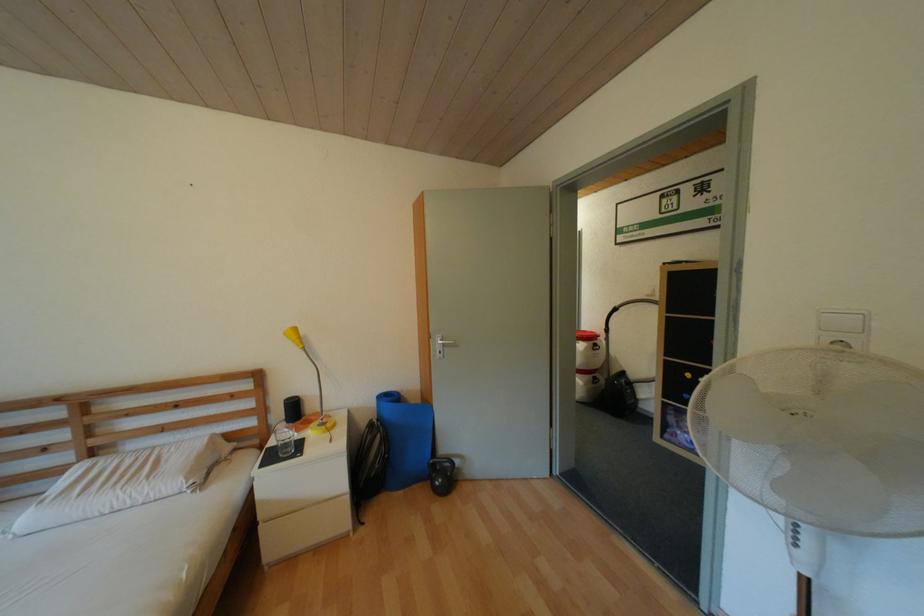
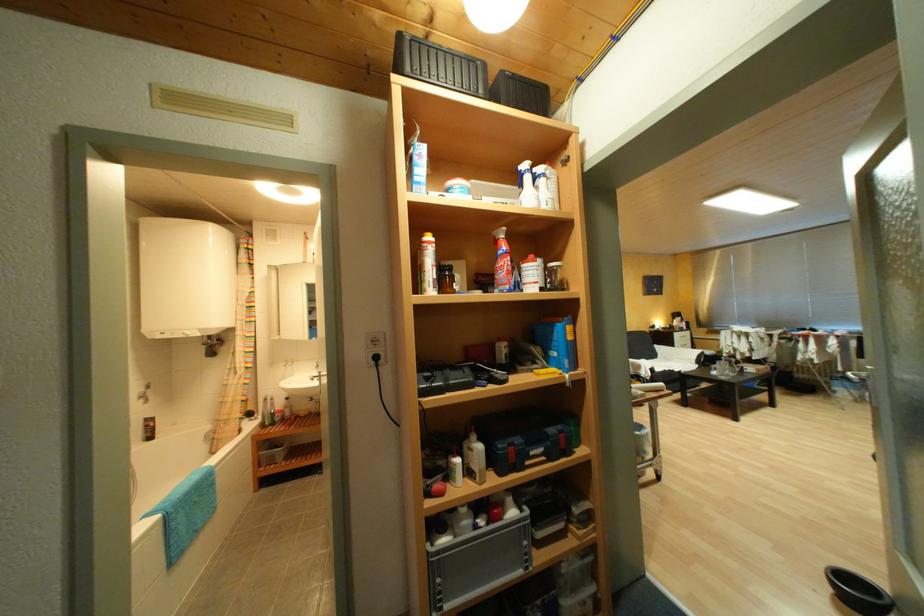
Question: The images are taken continuously from a first-person perspective. In which direction are you moving?

Choices:
 (A) Left
 (B) Right
 (C) Forward
 (D) Backward

Answer: (C)